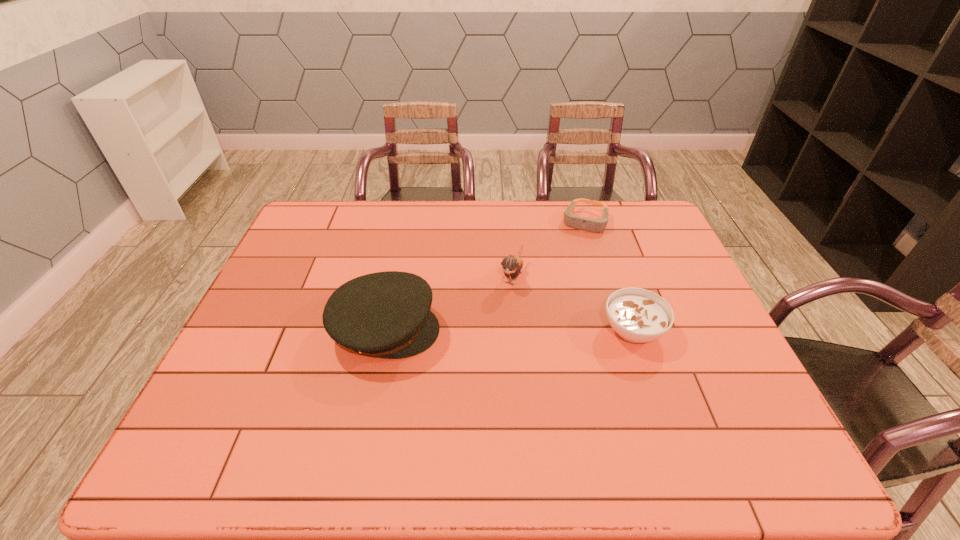
You are a GUI agent. You are given a task and a screenshot of the screen. Output one action in this format:
    pyautogui.click(x=<x>, y=<y>)
    Task: Click on the free space between the leftmost object and the soup bowl
    
    Given the screenshot: What is the action you would take?
    pyautogui.click(x=509, y=330)

You are a GUI agent. You are given a task and a screenshot of the screen. Output one action in this format:
    pyautogui.click(x=<x>, y=<y>)
    Task: Click on the free space between the farthest object and the tallest object
    
    Given the screenshot: What is the action you would take?
    pyautogui.click(x=486, y=276)

The image size is (960, 540). What are the coordinates of `free space that is in between the goggles and the beret` in the screenshot? It's located at (486, 276).

Where is `the second closest object relative to the soup bowl`? the second closest object relative to the soup bowl is located at coordinates (576, 222).

Select which object is the third closest to the goggles. Please provide its 2D coordinates. Your answer should be formatted as a tuple, i.e. [(x, y)], where the tuple contains the x and y coordinates of a point satisfying the conditions above.

[(387, 314)]

This screenshot has height=540, width=960. In order to click on vacant area in the image that satisfies the following two spatial constraints: 1. on the front side of the second shortest object; 2. on the left side of the second tallest object in this screenshot , I will do `click(516, 330)`.

Locate an element on the screen. This screenshot has width=960, height=540. vacant space that satisfies the following two spatial constraints: 1. on the front side of the soup bowl; 2. on the right side of the shortest object is located at coordinates (618, 330).